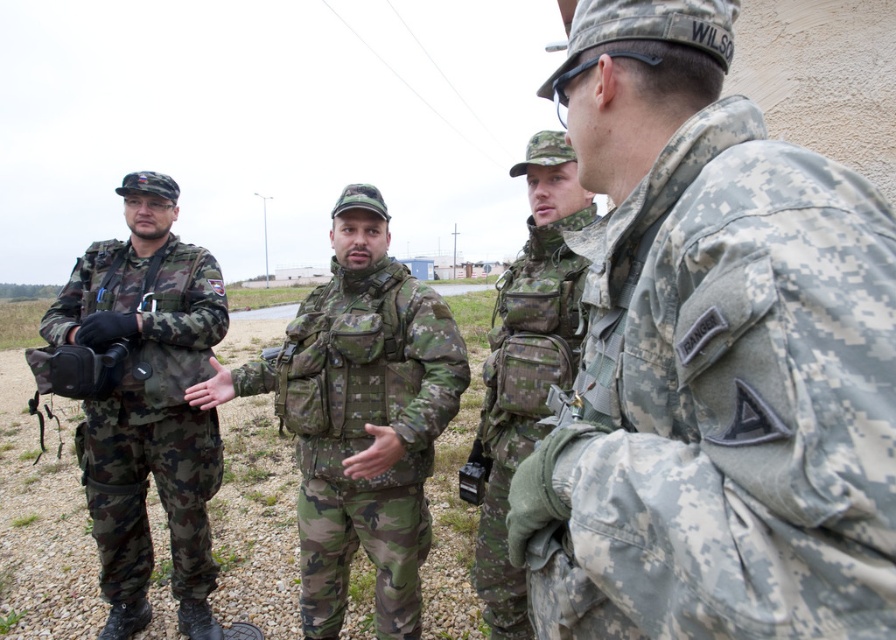
Which of these two, camouflage fabric jacket at center or camouflage fabric uniform at left, stands taller?

camouflage fabric uniform at left is taller.

The image size is (896, 640). What do you see at coordinates (727, 403) in the screenshot?
I see `camouflage fabric jacket at center` at bounding box center [727, 403].

Describe the element at coordinates (727, 403) in the screenshot. Image resolution: width=896 pixels, height=640 pixels. I see `camouflage fabric jacket at center` at that location.

You are a GUI agent. You are given a task and a screenshot of the screen. Output one action in this format:
    pyautogui.click(x=<x>, y=<y>)
    Task: Click on the camouflage fabric jacket at center
    The width and height of the screenshot is (896, 640).
    Given the screenshot: What is the action you would take?
    pyautogui.click(x=727, y=403)

Can you confirm if camouflage fabric jacket at center is shorter than camouflage fabric uniform at center?

Yes, camouflage fabric jacket at center is shorter than camouflage fabric uniform at center.

Locate an element on the screen. This screenshot has height=640, width=896. camouflage fabric jacket at center is located at coordinates (727, 403).

Based on the photo, who is more forward, (543, 561) or (366, 401)?

Point (543, 561) is more forward.

I want to click on camouflage fabric jacket at center, so click(x=727, y=403).

Does camouflage fabric uniform at left appear on the left side of camouflage fabric vest at center?

Correct, you'll find camouflage fabric uniform at left to the left of camouflage fabric vest at center.

Which is behind, point (140, 333) or point (521, 612)?

The point (140, 333) is more distant.

Find the location of a particular element. This screenshot has height=640, width=896. camouflage fabric uniform at left is located at coordinates (148, 410).